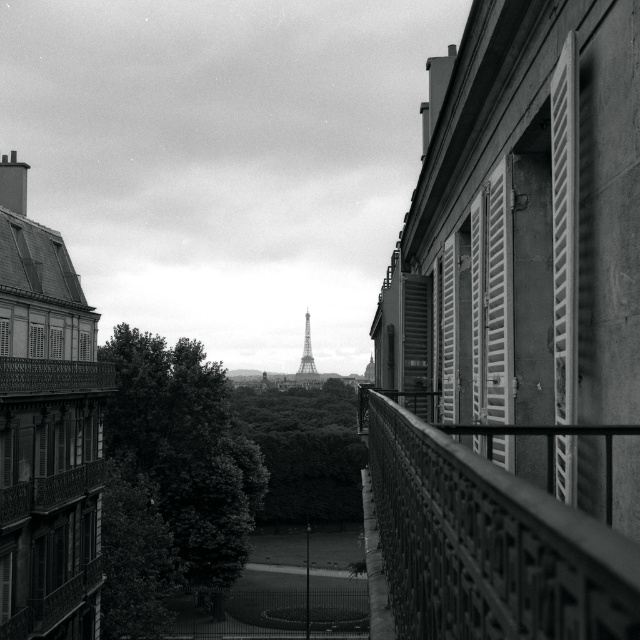
From the picture: You are standing on the balcony and want to take a photo of the metallic silver tower at center without the white painted wood shutter at left blocking the view. Is the tower visible from your current position?

The metallic silver tower at center is located below the white painted wood shutter at left, so the tower would be blocked by the shutter and not fully visible from your current position on the balcony.

You are standing on the balcony and want to take a photo of the white wooden shutter at right without including the green leafy tree at center in the frame. Based on their positions, is this possible?

The green leafy tree at center is located below the white wooden shutter at right, so if you position your camera to focus on the upper part of the white wooden shutter at right, you can exclude the tree from the photo.

You are standing on the balcony and want to take a photo of the green leafy tree at center and the white wooden shutter at right. Which object will appear larger in the photo?

The green leafy tree at center will appear larger in the photo because it is taller than the white wooden shutter at right.